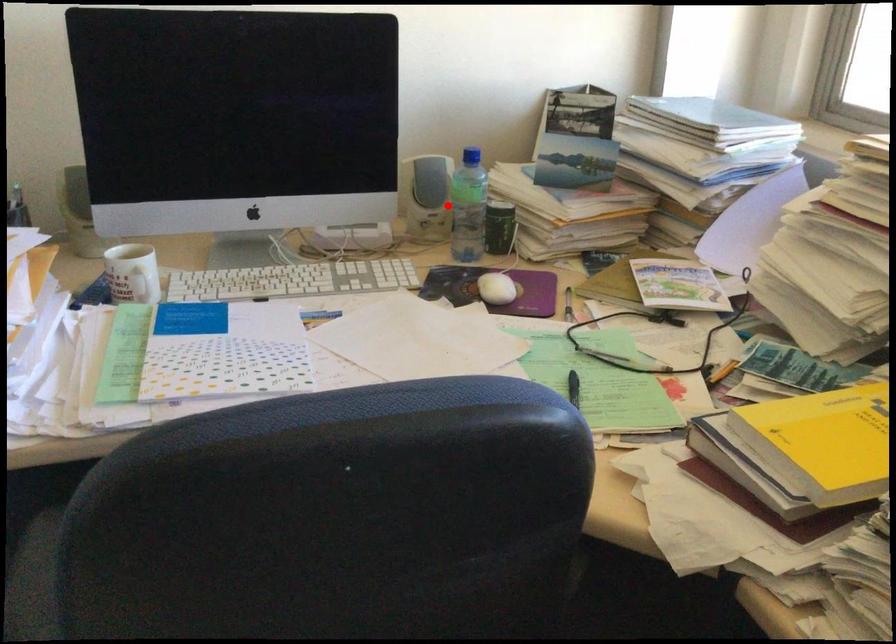
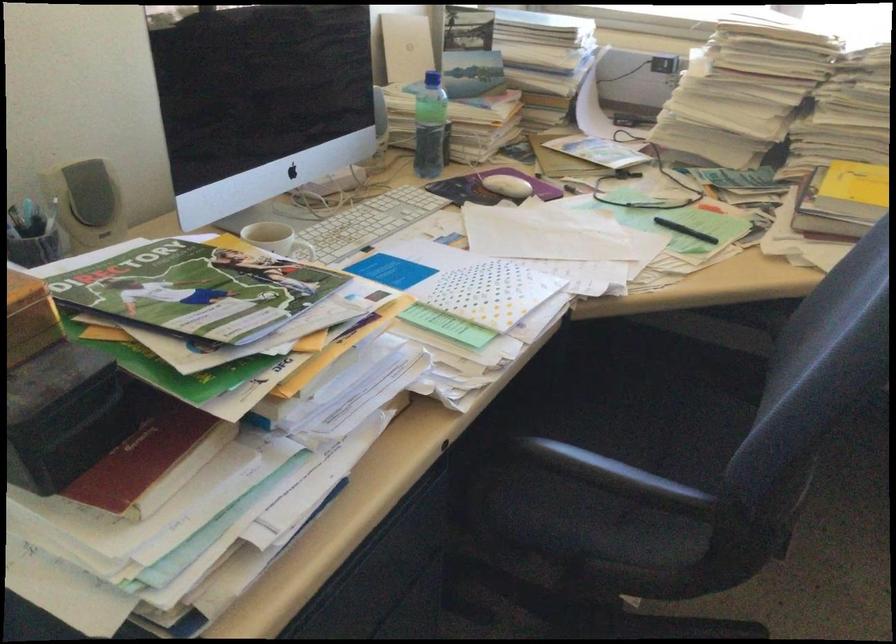
Locate, in the second image, the point that corresponds to the highlighted location in the first image.

(428, 126)